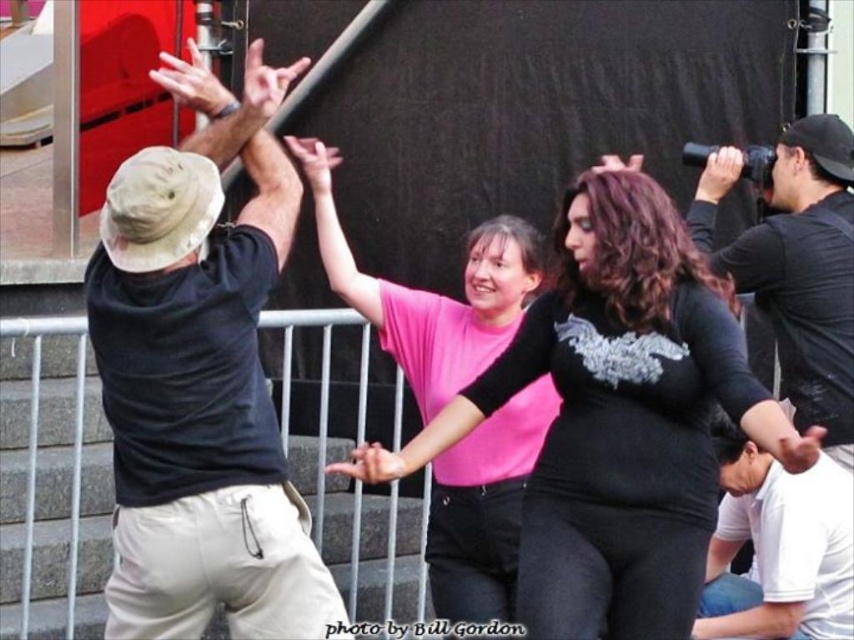
What do you see at coordinates (51, 481) in the screenshot? I see `metal/textured rail at left` at bounding box center [51, 481].

Who is positioned more to the left, metal/textured rail at left or white cotton shirt at lower right?

Positioned to the left is metal/textured rail at left.

Between point (392, 520) and point (793, 628), which one is positioned in front?

Point (793, 628) is in front.

Locate an element on the screen. metal/textured rail at left is located at coordinates pyautogui.click(x=51, y=481).

Can you confirm if khaki cotton shorts at left is shorter than white cotton shirt at lower right?

Incorrect, khaki cotton shorts at left's height does not fall short of white cotton shirt at lower right's.

Is khaki cotton shorts at left to the left of white cotton shirt at lower right from the viewer's perspective?

Yes, khaki cotton shorts at left is to the left of white cotton shirt at lower right.

Which is in front, point (126, 632) or point (771, 616)?

Positioned in front is point (126, 632).

Where is `khaki cotton shorts at left`? The width and height of the screenshot is (854, 640). khaki cotton shorts at left is located at coordinates (200, 378).

Can you confirm if matte black shirt at center is thinner than white cotton shirt at lower right?

No, matte black shirt at center is not thinner than white cotton shirt at lower right.

From the picture: Between matte black shirt at center and white cotton shirt at lower right, which one is positioned higher?

matte black shirt at center

Who is more distant from viewer, (598,388) or (800,509)?

The point (800,509) is more distant.

I want to click on matte black shirt at center, so click(x=616, y=417).